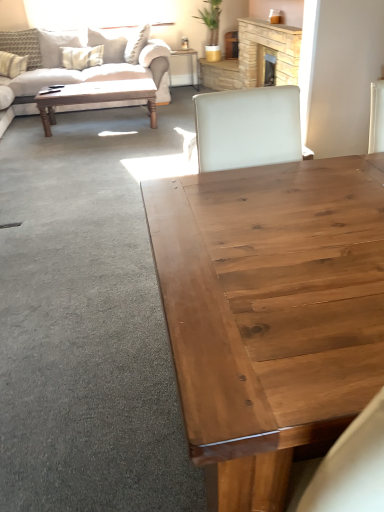
Question: Does beige fabric couch at upper left have a lesser height compared to wooden desk at center?

Choices:
 (A) yes
 (B) no

Answer: (B)

Question: Is beige fabric couch at upper left beside wooden desk at center?

Choices:
 (A) yes
 (B) no

Answer: (B)

Question: Considering the relative sizes of beige fabric couch at upper left and wooden desk at center in the image provided, is beige fabric couch at upper left wider than wooden desk at center?

Choices:
 (A) yes
 (B) no

Answer: (A)

Question: Is the depth of beige fabric couch at upper left greater than that of wooden desk at center?

Choices:
 (A) no
 (B) yes

Answer: (A)

Question: Is beige fabric couch at upper left turned away from wooden desk at center?

Choices:
 (A) no
 (B) yes

Answer: (A)

Question: Is beige fabric couch at upper left taller than wooden desk at center?

Choices:
 (A) yes
 (B) no

Answer: (A)

Question: Is the depth of wooden polished coffee table at upper left, placed as the second coffee table when sorted from front to back, greater than that of beige fabric couch at upper left?

Choices:
 (A) no
 (B) yes

Answer: (B)

Question: Would you say wooden polished coffee table at upper left, placed as the 2th coffee table when sorted from right to left, contains beige fabric couch at upper left?

Choices:
 (A) no
 (B) yes

Answer: (A)

Question: Does wooden polished coffee table at upper left, which is counted as the second coffee table, starting from the bottom, have a larger size compared to beige fabric couch at upper left?

Choices:
 (A) yes
 (B) no

Answer: (B)

Question: Can you confirm if wooden polished coffee table at upper left, placed as the second coffee table when sorted from front to back, is shorter than beige fabric couch at upper left?

Choices:
 (A) no
 (B) yes

Answer: (B)

Question: Is wooden polished coffee table at upper left, placed as the second coffee table when sorted from front to back, oriented away from beige fabric couch at upper left?

Choices:
 (A) yes
 (B) no

Answer: (A)

Question: Is wooden polished coffee table at upper left, the first coffee table when ordered from left to right, outside of beige fabric couch at upper left?

Choices:
 (A) no
 (B) yes

Answer: (A)

Question: Are beige fabric couch at upper left and white textured pillow at upper left, which ranks as the 3th pillow in left-to-right order, making contact?

Choices:
 (A) yes
 (B) no

Answer: (B)